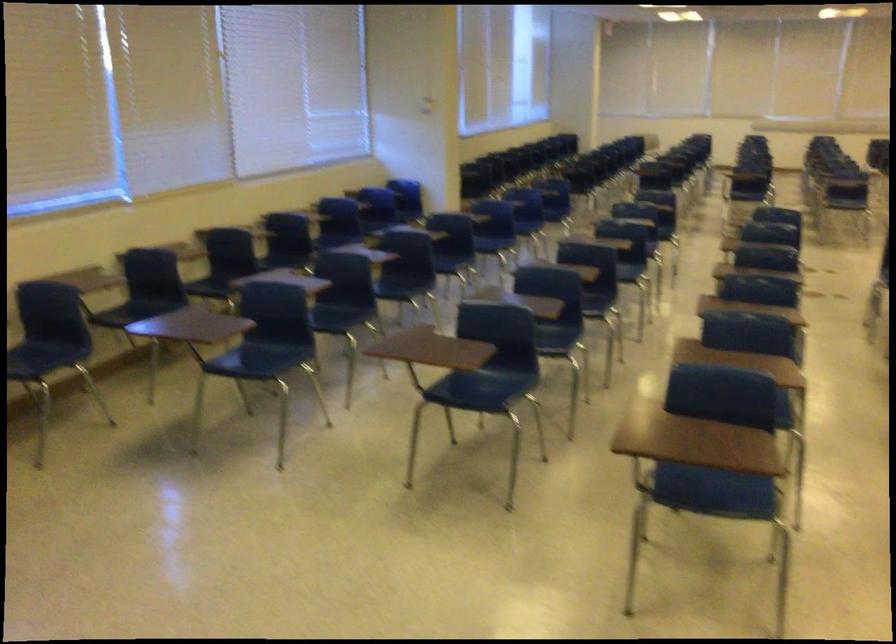
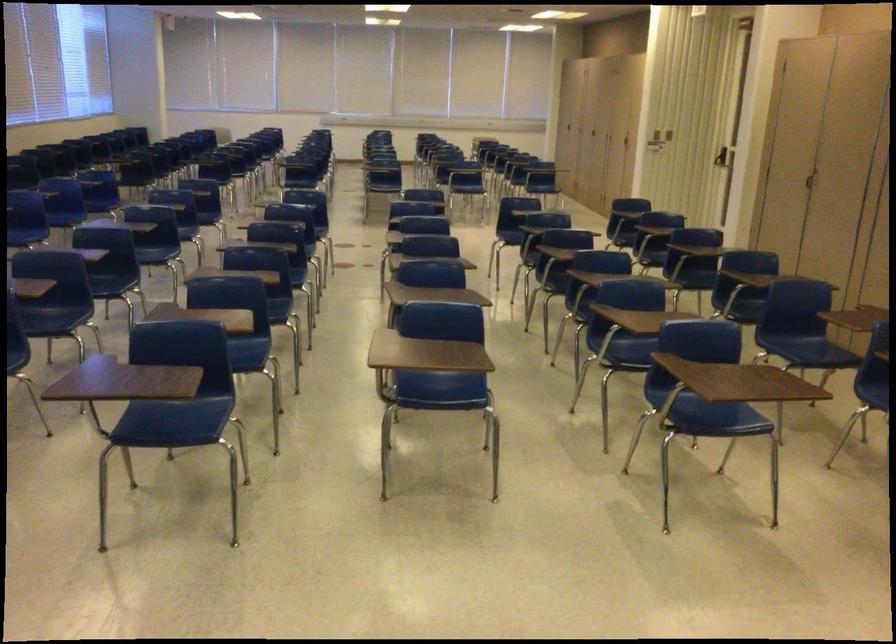
The point at (711,487) is marked in the first image. Where is the corresponding point in the second image?

(173, 422)